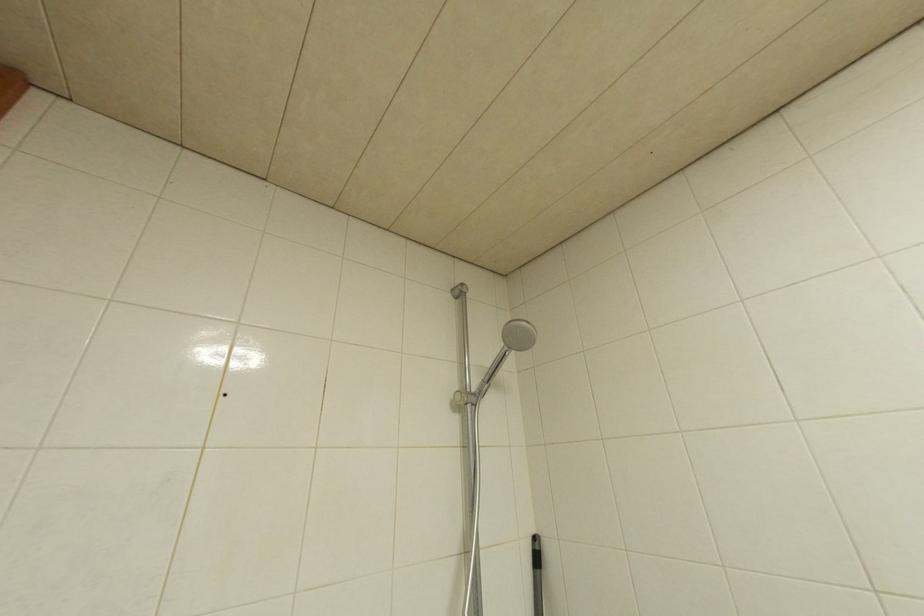
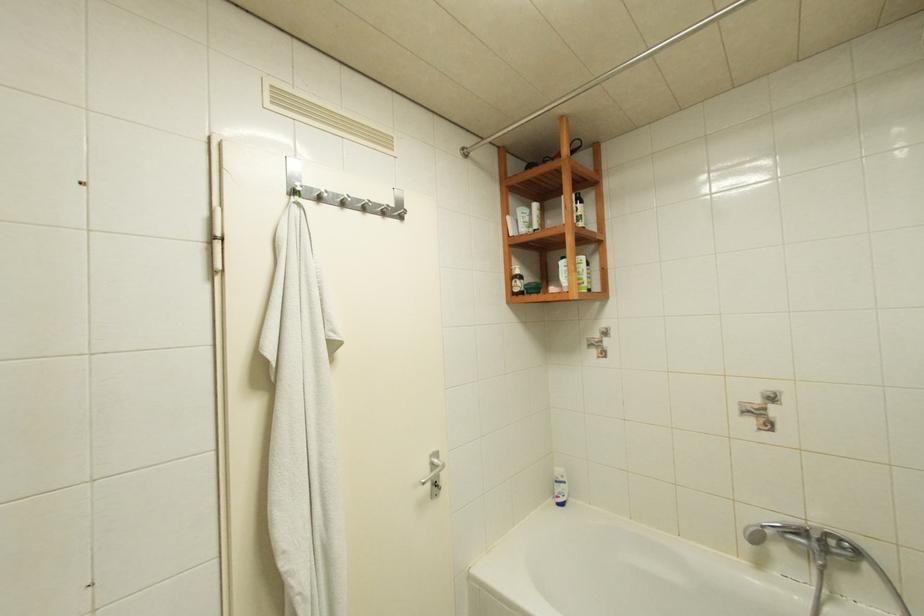
Question: The camera is either moving clockwise (left) or counter-clockwise (right) around the object. The first image is from the beginning of the video and the second image is from the end. Is the camera moving left or right when shooting the video?

Choices:
 (A) Left
 (B) Right

Answer: (A)